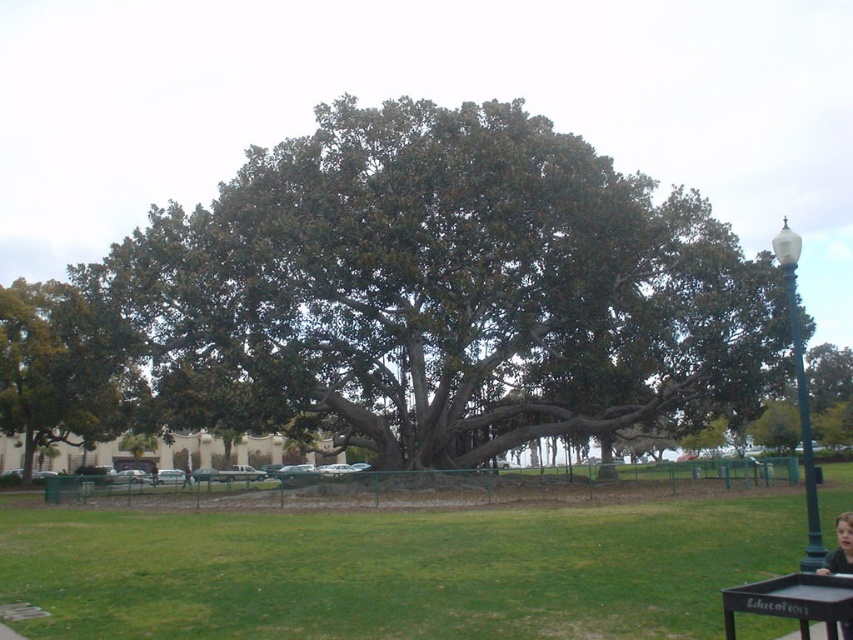
You are planning to set up a picnic area near the green leafy oak tree at center and the black painted wood picnic table at lower right. Based on their positions, which object is closer to the right side of the image?

The black painted wood picnic table at lower right is closer to the right side of the image because it is positioned to the right of the green leafy oak tree at center.

You are standing at the origin point of the image. Which direction should you walk to reach the green leafy oak tree at center?

The green leafy oak tree at center is located at point (x=445, y=291), so you should walk towards the northeast direction to reach it.

Based on the photo, you are a landscape architect designing a new park. You need to place a new bench between the green leafy oak tree at center and the green metal pole at right. Based on their sizes, which object should the bench be closer to to ensure it doesn

The green leafy oak tree at center might be wider than the green metal pole at right. Therefore, the bench should be placed closer to the green metal pole at right to avoid being too close to the wider tree.